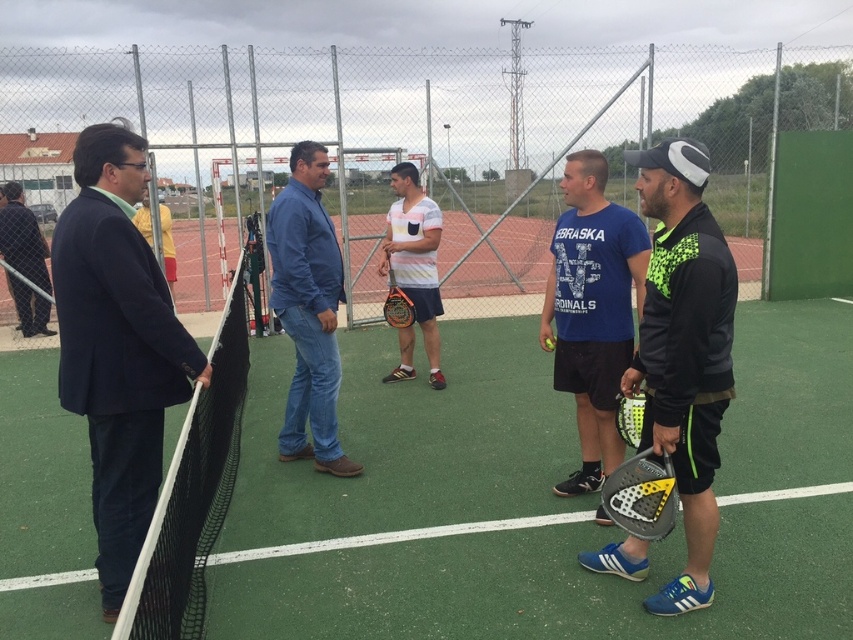
Question: Among these objects, which one is nearest to the camera?

Choices:
 (A) yellow matte racket at lower right
 (B) white striped shirt at center
 (C) dark blue suit at left
 (D) black mesh net at left

Answer: (D)

Question: Does black mesh net at left appear on the right side of orange matte tennis racket at center?

Choices:
 (A) yes
 (B) no

Answer: (B)

Question: Which object appears farthest from the camera in this image?

Choices:
 (A) dark blue suit at left
 (B) orange matte tennis racket at center
 (C) white striped shirt at center

Answer: (B)

Question: Is dark blue suit at left wider than blue fabric shirt at center?

Choices:
 (A) no
 (B) yes

Answer: (B)

Question: Which point is closer to the camera?

Choices:
 (A) blue denim jeans at center
 (B) yellow matte racket at lower right

Answer: (B)

Question: Is black mesh net at left positioned at the back of white striped shirt at center?

Choices:
 (A) yes
 (B) no

Answer: (B)